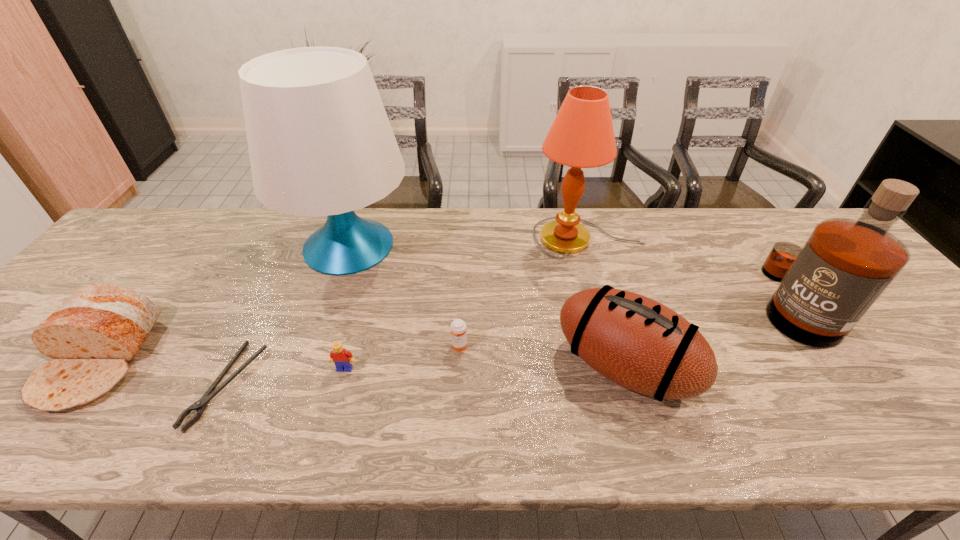
At what (x,y) coordinates should I click in order to perform the action: click on table lamp. Please return your answer as a coordinate pair (x, y). Looking at the image, I should click on (320, 143).

In order to click on lamp in this screenshot , I will do `click(582, 136)`.

The width and height of the screenshot is (960, 540). I want to click on the rightmost object, so pos(827,286).

Image resolution: width=960 pixels, height=540 pixels. I want to click on the fourth tallest object, so click(x=638, y=343).

At what (x,y) coordinates should I click in order to perform the action: click on the fifth tallest object. Please return your answer as a coordinate pair (x, y). The image size is (960, 540). Looking at the image, I should click on (100, 327).

I want to click on bread, so click(x=100, y=327).

Image resolution: width=960 pixels, height=540 pixels. I want to click on Lego, so click(x=339, y=355).

Identify the location of the fourth object from right to left. 458,327.

Find the location of a particular element. The width and height of the screenshot is (960, 540). the shortest object is located at coordinates click(x=200, y=405).

Identify the location of vacant region located on the front-facing side of the table lamp. This screenshot has width=960, height=540. (327, 311).